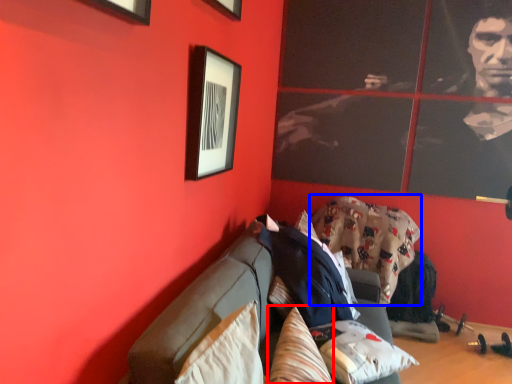
Question: Which object appears farthest to the camera in this image, pillow (highlighted by a red box) or blanket (highlighted by a blue box)?

Choices:
 (A) pillow
 (B) blanket

Answer: (B)